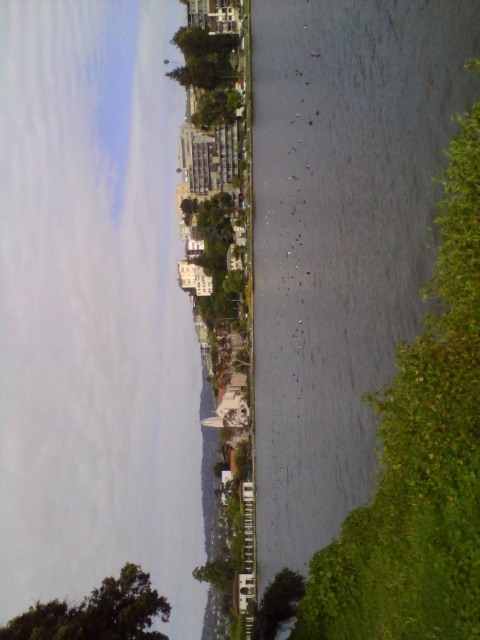
Question: Is clear water at center wider than green leafy tree at lower right?

Choices:
 (A) yes
 (B) no

Answer: (A)

Question: Based on their relative distances, which object is nearer to the green leafy tree at lower left?

Choices:
 (A) green leafy tree at lower right
 (B) clear water at center
 (C) green leafy tree at lower center

Answer: (C)

Question: Which object is positioned farthest from the green leafy tree at lower center?

Choices:
 (A) clear water at center
 (B) green leafy tree at lower right
 (C) green leafy tree at lower left

Answer: (A)

Question: Can you confirm if green leafy tree at lower left is wider than green leafy tree at lower center?

Choices:
 (A) yes
 (B) no

Answer: (A)

Question: Is clear water at center thinner than green leafy tree at lower center?

Choices:
 (A) yes
 (B) no

Answer: (B)

Question: Which point is closer to the camera taking this photo?

Choices:
 (A) (91, 628)
 (B) (39, 429)
 (C) (276, 627)
 (D) (441, 566)

Answer: (D)